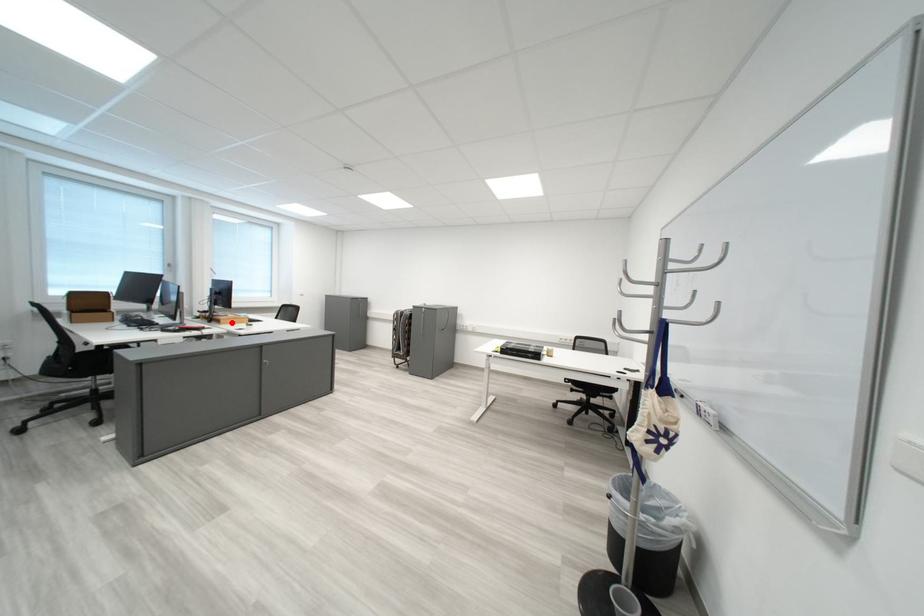
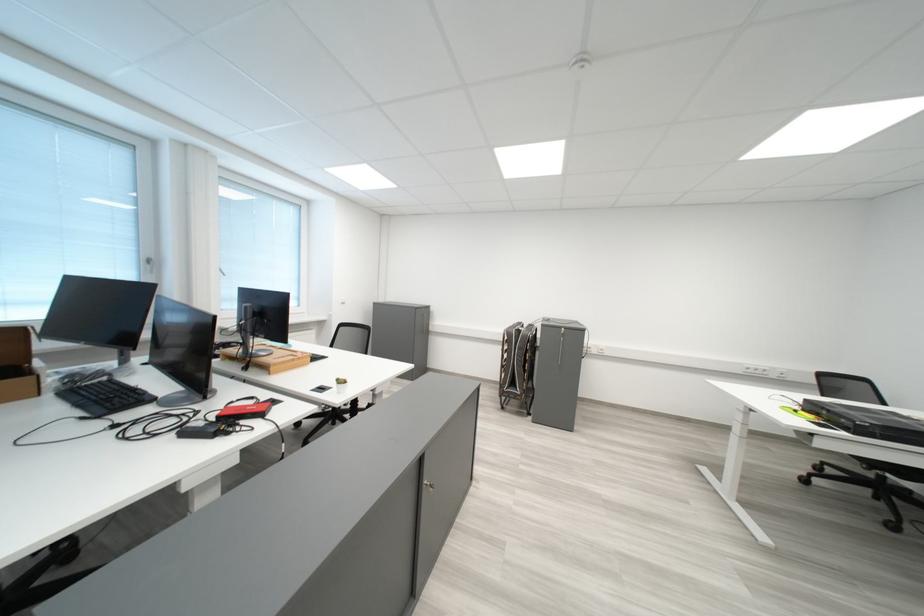
Locate, in the second image, the point that corresponds to the highlighted location in the first image.

(277, 369)